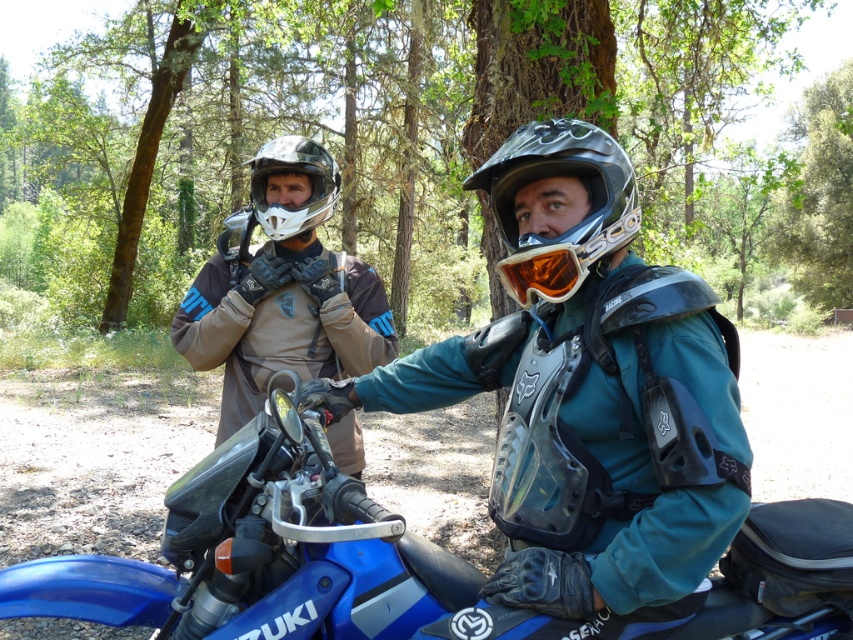
Can you confirm if blue metallic motorcycle at center is wider than matte black jacket at center?

Yes.

Does blue metallic motorcycle at center have a smaller size compared to matte black jacket at center?

Actually, blue metallic motorcycle at center might be larger than matte black jacket at center.

Locate an element on the screen. The image size is (853, 640). blue metallic motorcycle at center is located at coordinates (96, 456).

Can you confirm if teal matte jacket at center is positioned to the left of matte black helmet at upper center?

In fact, teal matte jacket at center is to the right of matte black helmet at upper center.

Can you confirm if teal matte jacket at center is positioned above matte black helmet at upper center?

No.

Image resolution: width=853 pixels, height=640 pixels. Describe the element at coordinates (585, 390) in the screenshot. I see `teal matte jacket at center` at that location.

Locate an element on the screen. Image resolution: width=853 pixels, height=640 pixels. teal matte jacket at center is located at coordinates (585, 390).

Between matte black jacket at center and matte black helmet at center, which one appears on the right side from the viewer's perspective?

matte black helmet at center is more to the right.

Between point (331, 259) and point (567, 136), which one is positioned behind?

The point (331, 259) is more distant.

Where is `matte black jacket at center`? The width and height of the screenshot is (853, 640). matte black jacket at center is located at coordinates (283, 289).